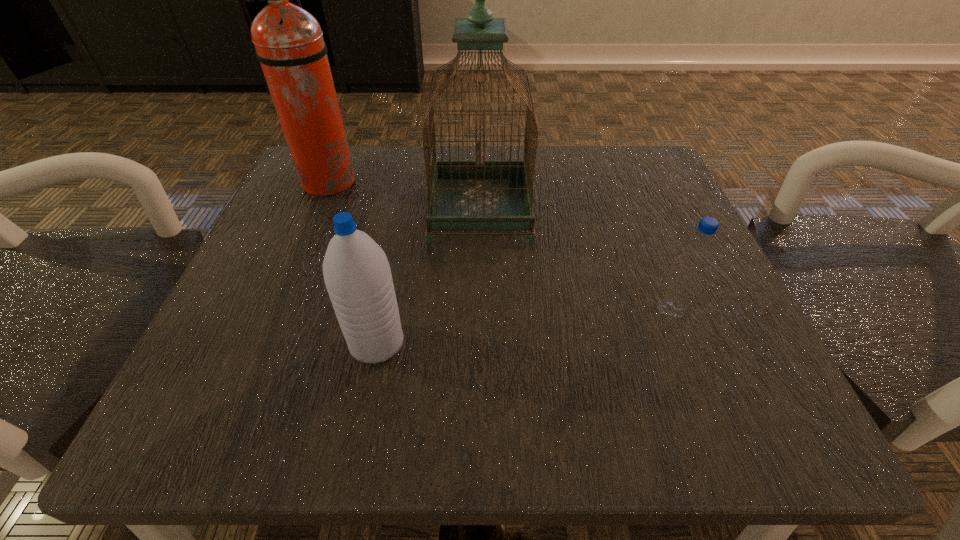
The image size is (960, 540). I want to click on vacant area that lies between the leftmost object and the rightmost object, so click(x=498, y=246).

Identify the location of object that stands as the third closest to the rightmost object. Image resolution: width=960 pixels, height=540 pixels. (289, 43).

What are the coordinates of `object that is the second nearest to the third object from left to right` in the screenshot? It's located at (357, 274).

At what (x,y) coordinates should I click in order to perform the action: click on free space that satisfies the following two spatial constraints: 1. at the nozzle of the fire extinguisher; 2. on the back side of the left water bottle. Please return your answer as a coordinate pair (x, y). The image size is (960, 540). Looking at the image, I should click on (260, 343).

The width and height of the screenshot is (960, 540). Identify the location of free spot that satisfies the following two spatial constraints: 1. at the nozzle of the second object from left to right; 2. on the left side of the fire extinguisher. (260, 343).

Where is `free spot that satisfies the following two spatial constraints: 1. on the back side of the left water bottle; 2. at the nozzle of the leftmost object`? Image resolution: width=960 pixels, height=540 pixels. free spot that satisfies the following two spatial constraints: 1. on the back side of the left water bottle; 2. at the nozzle of the leftmost object is located at coordinates (408, 183).

Where is `vacant space that satisfies the following two spatial constraints: 1. at the door of the shorter water bottle; 2. on the right side of the third object from left to right`? vacant space that satisfies the following two spatial constraints: 1. at the door of the shorter water bottle; 2. on the right side of the third object from left to right is located at coordinates (480, 310).

Where is `free location that satisfies the following two spatial constraints: 1. at the nozzle of the shortest object; 2. on the right side of the fire extinguisher`? free location that satisfies the following two spatial constraints: 1. at the nozzle of the shortest object; 2. on the right side of the fire extinguisher is located at coordinates (275, 310).

Locate an element on the screen. free location that satisfies the following two spatial constraints: 1. at the door of the second object from right to left; 2. on the front side of the left water bottle is located at coordinates (480, 343).

Identify the location of free space in the image that satisfies the following two spatial constraints: 1. at the door of the birdcage; 2. on the front side of the third object from right to left. (480, 343).